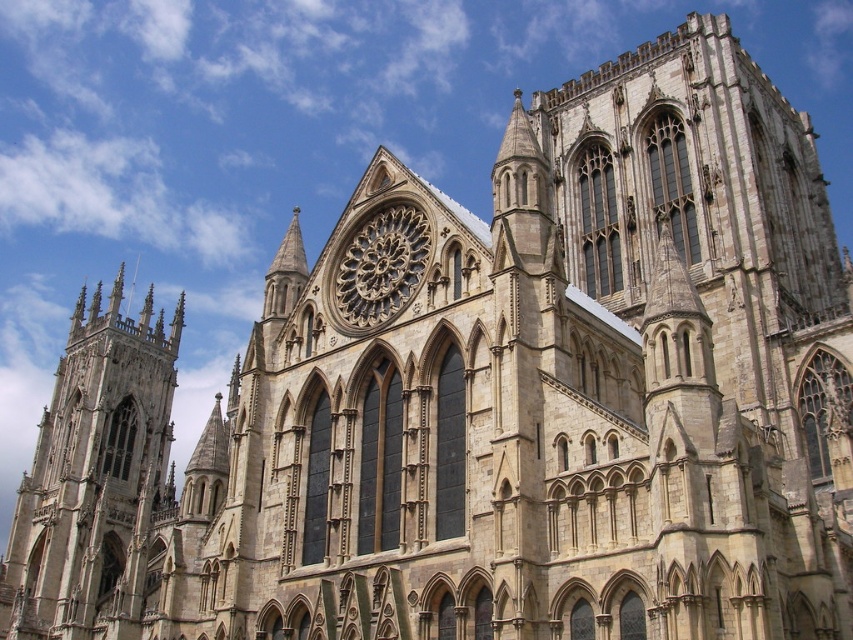
You are standing at the entrance of York Minster and want to take a photo of the stone gothic tower at left. Based on its position, which direction should you face to capture it in your shot?

The stone gothic tower at left is located at point (93, 477), which means it is positioned to the left side of the cathedral. To capture it in your photo, you should face towards the left side of the cathedral.

You are standing in front of York Minster and want to take a photo of the stone gothic tower at left. If your camera can focus on objects up to 200 feet away, will you be able to capture the tower clearly?

The stone gothic tower at left is 190.59 feet away from the viewer. Since the camera can focus up to 200 feet, it is within range, so yes, the tower can be captured clearly.

You are standing in front of York Minster and want to take a photo of both the stone gothic tower at left and the golden stone rose window at center. Based on their positions, will the tower appear above or below the rose window in your photo?

The stone gothic tower at left is below the golden stone rose window at center, so in your photo, the tower will appear below the rose window.